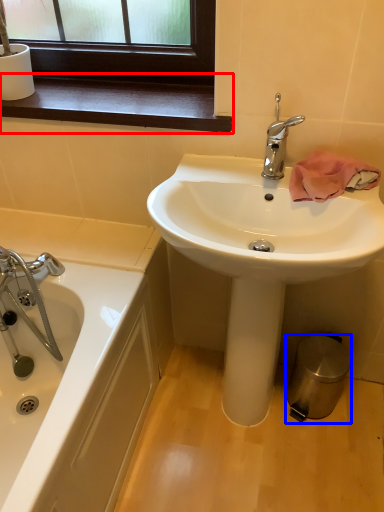
Question: Which object appears farthest to the camera in this image, window sill (highlighted by a red box) or trash bin/can (highlighted by a blue box)?

Choices:
 (A) window sill
 (B) trash bin/can

Answer: (B)